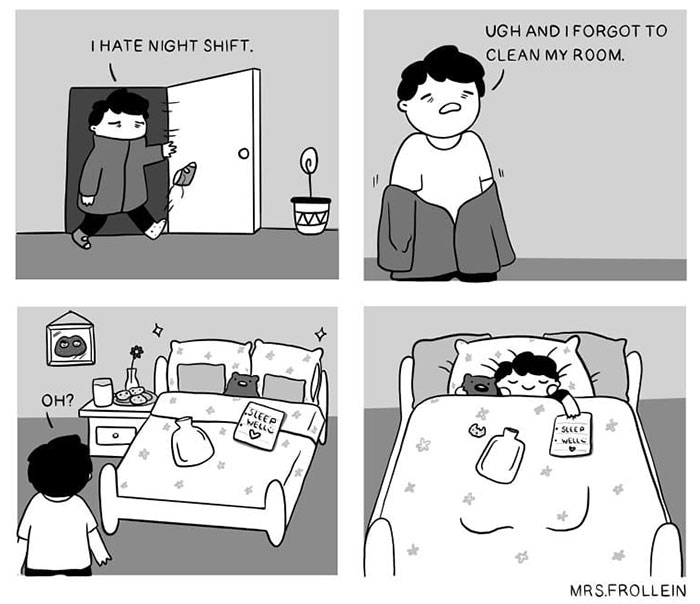
At what (x,y) coordinates should I click in order to perform the action: click on door. Please return your answer as a coordinate pair (x, y). This screenshot has height=604, width=700. Looking at the image, I should click on (222, 106).